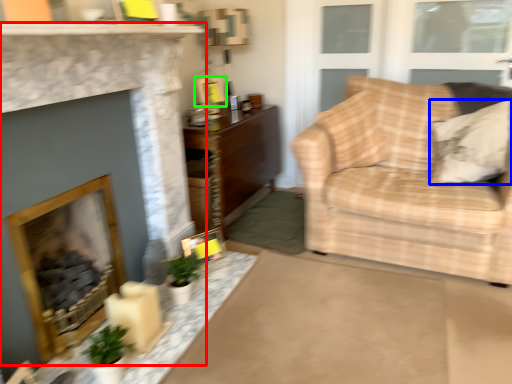
Question: Based on their relative distances, which object is farther from fireplace (highlighted by a red box)? Choose from pillow (highlighted by a blue box) and picture frame (highlighted by a green box).

Choices:
 (A) pillow
 (B) picture frame

Answer: (A)